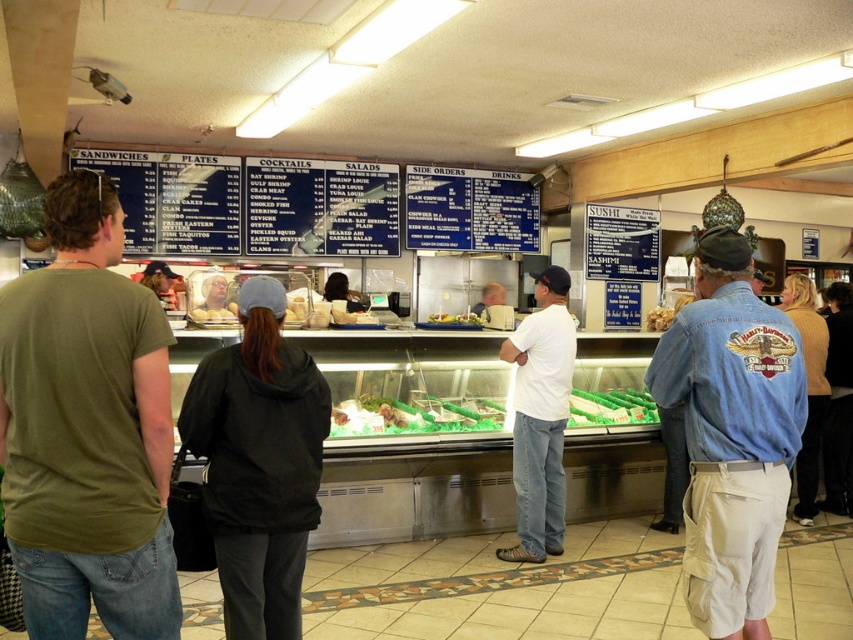
You are standing at the counter in the seafood restaurant and want to check the menu boards. Which of the two points, point (715, 604) or point (520, 380), is closer to you?

Point (715, 604) is closer to the camera than point (520, 380), so it is closer to you.

You are a customer standing at the counter in the dining establishment. You notice two points marked on the menu boards. Which point, point (181, 442) or point (374, 397), is closer to you?

Point (181, 442) is closer to the camera than point (374, 397), so it is closer to you.